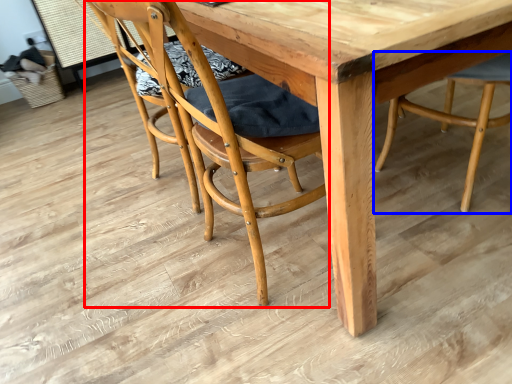
Question: Which object is further to the camera taking this photo, chair (highlighted by a red box) or chair (highlighted by a blue box)?

Choices:
 (A) chair
 (B) chair

Answer: (B)